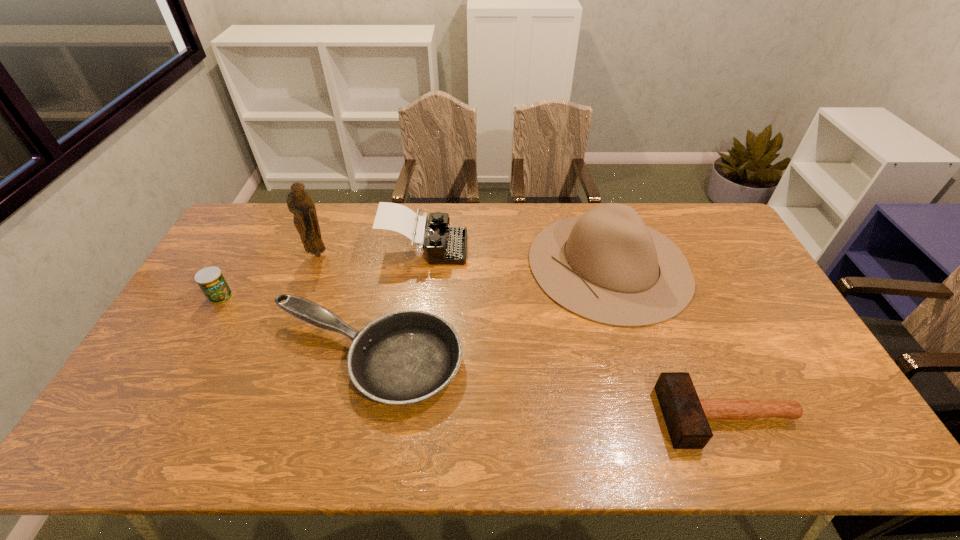
Identify the location of unoccupied area between the can and the frying pan. (293, 328).

This screenshot has height=540, width=960. In order to click on vacant point located between the fifth shortest object and the typewriter in this screenshot , I will do `click(516, 257)`.

Where is `free spot between the sombrero and the frying pan`? This screenshot has width=960, height=540. free spot between the sombrero and the frying pan is located at coordinates (487, 312).

Choose which object is the third nearest neighbor to the figurine. Please provide its 2D coordinates. Your answer should be formatted as a tuple, i.e. [(x, y)], where the tuple contains the x and y coordinates of a point satisfying the conditions above.

[(407, 356)]

Identify which object is located as the fifth nearest to the frying pan. Please provide its 2D coordinates. Your answer should be formatted as a tuple, i.e. [(x, y)], where the tuple contains the x and y coordinates of a point satisfying the conditions above.

[(686, 416)]

The width and height of the screenshot is (960, 540). I want to click on blank space that satisfies the following two spatial constraints: 1. on the back side of the second tallest object; 2. on the right side of the can, so coord(239,265).

Where is `vacant position in the image that satisfies the following two spatial constraints: 1. on the front-facing side of the sombrero; 2. on the left side of the tallest object`? This screenshot has height=540, width=960. vacant position in the image that satisfies the following two spatial constraints: 1. on the front-facing side of the sombrero; 2. on the left side of the tallest object is located at coordinates (314, 265).

Where is `blank area in the image that satisfies the following two spatial constraints: 1. on the keys of the sombrero; 2. on the left side of the fourth shortest object`? Image resolution: width=960 pixels, height=540 pixels. blank area in the image that satisfies the following two spatial constraints: 1. on the keys of the sombrero; 2. on the left side of the fourth shortest object is located at coordinates (x=422, y=265).

Find the location of `vacant space that satisfies the following two spatial constraints: 1. on the front-facing side of the second tallest object; 2. on the right side of the tallest object`. vacant space that satisfies the following two spatial constraints: 1. on the front-facing side of the second tallest object; 2. on the right side of the tallest object is located at coordinates (314, 265).

At what (x,y) coordinates should I click in order to perform the action: click on free spot that satisfies the following two spatial constraints: 1. on the back side of the sombrero; 2. on the keys of the fourth shortest object. Please return your answer as a coordinate pair (x, y). This screenshot has height=540, width=960. Looking at the image, I should click on (604, 249).